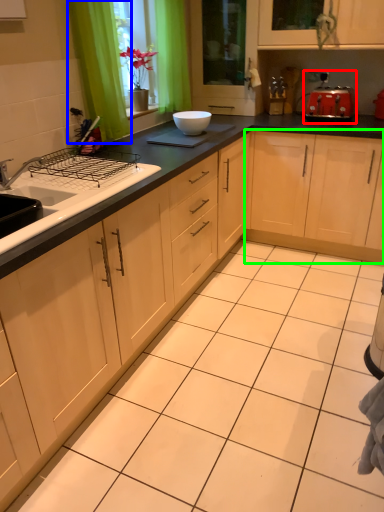
Question: Considering the real-world distances, which object is farthest from appliance (highlighted by a red box)? curtain (highlighted by a blue box) or cabinetry (highlighted by a green box)?

Choices:
 (A) curtain
 (B) cabinetry

Answer: (A)